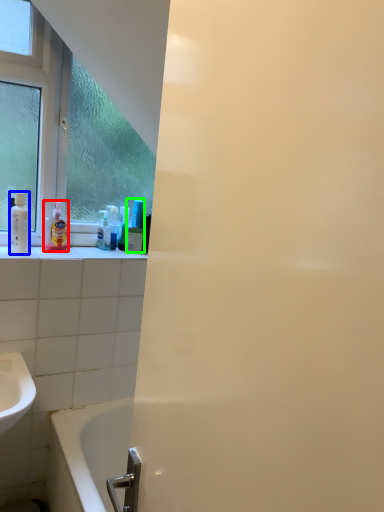
Question: Which object is the farthest from cleaning product (highlighted by a red box)? Choose among these: mouthwash (highlighted by a blue box) or mouthwash (highlighted by a green box).

Choices:
 (A) mouthwash
 (B) mouthwash

Answer: (B)